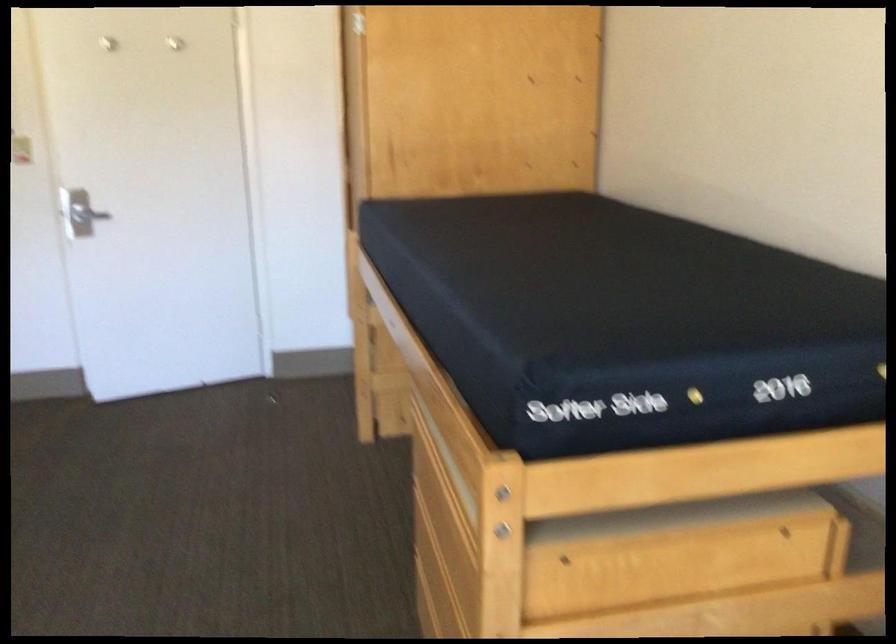
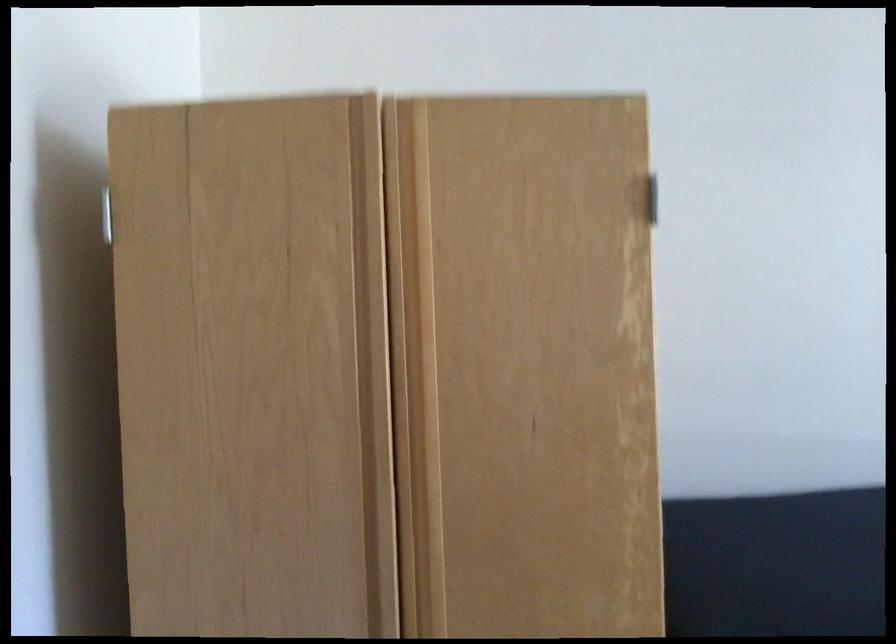
In the second image, find the point that corresponds to (x=382, y=84) in the first image.

(414, 368)